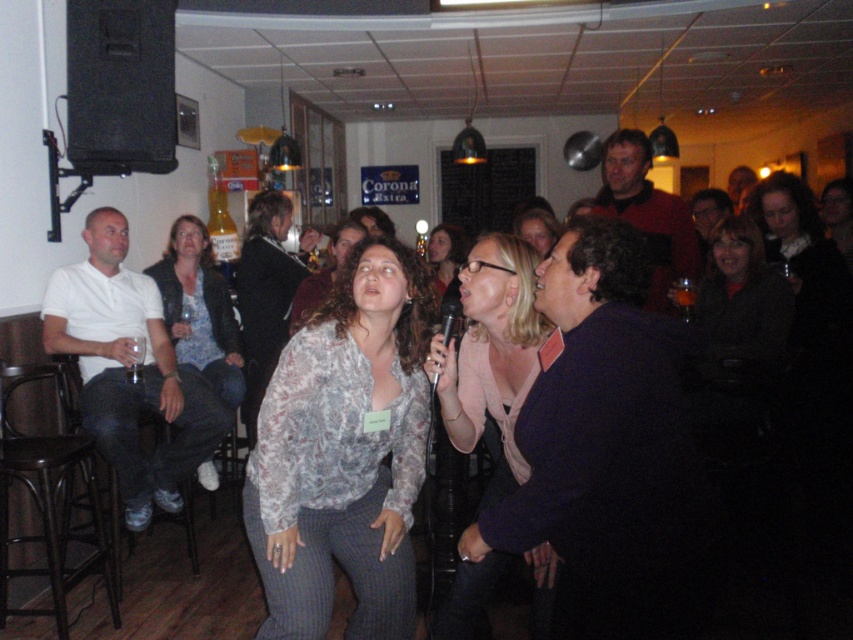
Question: Is white cotton shirt at left closer to the viewer compared to black plastic microphone at center?

Choices:
 (A) yes
 (B) no

Answer: (B)

Question: Which of the following is the closest to the observer?

Choices:
 (A) (282, 316)
 (B) (527, 237)

Answer: (B)

Question: Which point appears closest to the camera in this image?

Choices:
 (A) (721, 356)
 (B) (631, 198)
 (C) (399, 605)
 (D) (463, 284)

Answer: (C)

Question: Which point appears closest to the camera in this image?

Choices:
 (A) (727, 244)
 (B) (521, 289)

Answer: (B)

Question: Does white cotton shirt at left have a smaller size compared to matte pink blouse at center?

Choices:
 (A) no
 (B) yes

Answer: (A)

Question: Is matte pink blouse at center thinner than black plastic microphone at center?

Choices:
 (A) no
 (B) yes

Answer: (A)